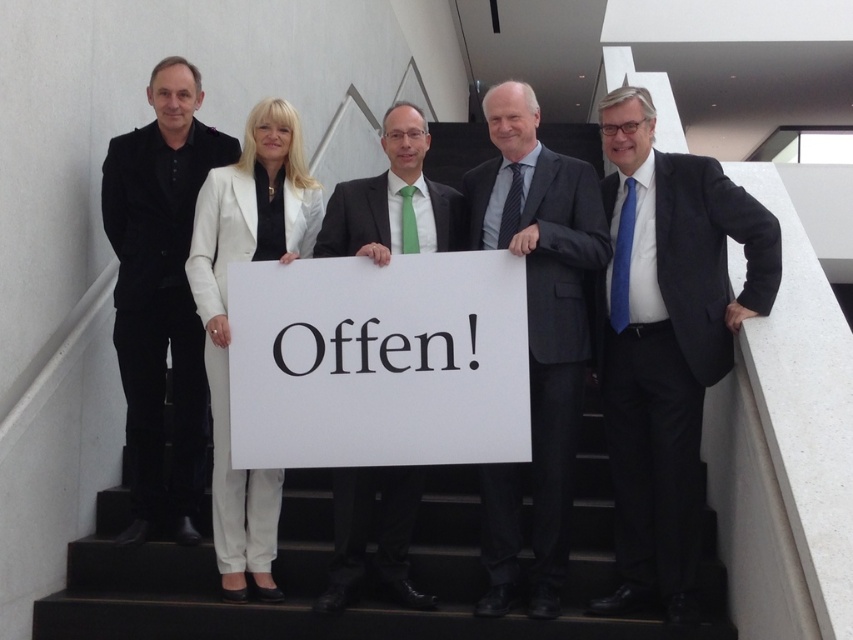
Measure the distance from blue silk tie at right to white smooth suit at center.

The distance of blue silk tie at right from white smooth suit at center is 6.26 feet.

Which of these two, blue silk tie at right or white smooth suit at center, stands shorter?

white smooth suit at center is shorter.

Which is in front, point (618, 202) or point (221, 429)?

Positioned in front is point (221, 429).

The width and height of the screenshot is (853, 640). In order to click on blue silk tie at right in this screenshot , I will do `click(666, 340)`.

Does point (122, 204) lie in front of point (538, 472)?

No, it is not.

Which is more to the left, black matte suit at left or dark gray suit at center?

black matte suit at left is more to the left.

Between point (178, 140) and point (553, 216), which one is positioned behind?

Positioned behind is point (178, 140).

The height and width of the screenshot is (640, 853). I want to click on black matte suit at left, so click(160, 291).

Is point (747, 204) closer to viewer compared to point (670, 472)?

No, (747, 204) is behind (670, 472).

Which is above, matte black suit at center or blue silk tie at right?

matte black suit at center is higher up.

You are a GUI agent. You are given a task and a screenshot of the screen. Output one action in this format:
    pyautogui.click(x=<x>, y=<y>)
    Task: Click on the matte black suit at center
    This screenshot has height=640, width=853.
    Given the screenshot: What is the action you would take?
    [x=640, y=316]